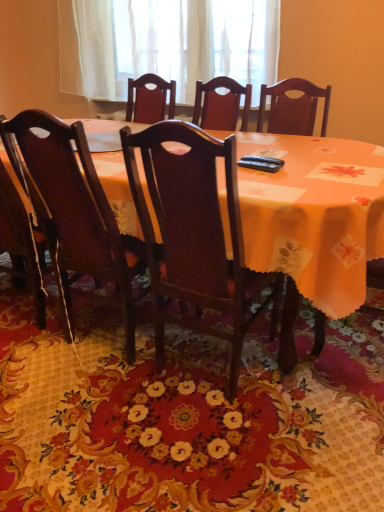
Question: From the image's perspective, is dark wood chair at center, the second chair from the left, on top of white sheer curtain at upper center?

Choices:
 (A) yes
 (B) no

Answer: (B)

Question: Can you confirm if dark wood chair at center, placed as the 1th chair when sorted from right to left, is thinner than white sheer curtain at upper center?

Choices:
 (A) no
 (B) yes

Answer: (A)

Question: From a real-world perspective, is dark wood chair at center, placed as the 1th chair when sorted from right to left, over white sheer curtain at upper center?

Choices:
 (A) yes
 (B) no

Answer: (B)

Question: Is dark wood chair at center, the second chair from the left, at the right side of white sheer curtain at upper center?

Choices:
 (A) yes
 (B) no

Answer: (A)

Question: Considering the relative sizes of dark wood chair at center, placed as the 1th chair when sorted from right to left, and white sheer curtain at upper center in the image provided, is dark wood chair at center, placed as the 1th chair when sorted from right to left, wider than white sheer curtain at upper center?

Choices:
 (A) no
 (B) yes

Answer: (B)

Question: Considering the positions of orange fabric table at center and dark wood chair at center, placed as the 1th chair when sorted from right to left, in the image, is orange fabric table at center wider or thinner than dark wood chair at center, placed as the 1th chair when sorted from right to left,?

Choices:
 (A) thin
 (B) wide

Answer: (B)

Question: Is orange fabric table at center situated inside dark wood chair at center, the second chair from the left, or outside?

Choices:
 (A) outside
 (B) inside

Answer: (A)

Question: From a real-world perspective, relative to dark wood chair at center, the second chair from the left, is orange fabric table at center vertically above or below?

Choices:
 (A) above
 (B) below

Answer: (B)

Question: Considering their positions, is orange fabric table at center located in front of or behind dark wood chair at center, placed as the 1th chair when sorted from right to left?

Choices:
 (A) front
 (B) behind

Answer: (B)

Question: In terms of width, does orange fabric table at center look wider or thinner when compared to wooden chair at center, the second chair in the right-to-left sequence?

Choices:
 (A) thin
 (B) wide

Answer: (B)

Question: Considering the positions of point (291, 187) and point (77, 179), is point (291, 187) closer or farther from the camera than point (77, 179)?

Choices:
 (A) closer
 (B) farther

Answer: (A)

Question: Relative to wooden chair at center, acting as the first chair starting from the left, is orange fabric table at center in front or behind?

Choices:
 (A) behind
 (B) front

Answer: (B)

Question: From the image's perspective, is orange fabric table at center above or below wooden chair at center, the second chair in the right-to-left sequence?

Choices:
 (A) below
 (B) above

Answer: (B)

Question: From the image's perspective, relative to floral carpet at center, is dark wood chair at center, the second chair from the left, above or below?

Choices:
 (A) below
 (B) above

Answer: (B)

Question: Based on their sizes in the image, would you say dark wood chair at center, the second chair from the left, is bigger or smaller than floral carpet at center?

Choices:
 (A) big
 (B) small

Answer: (A)